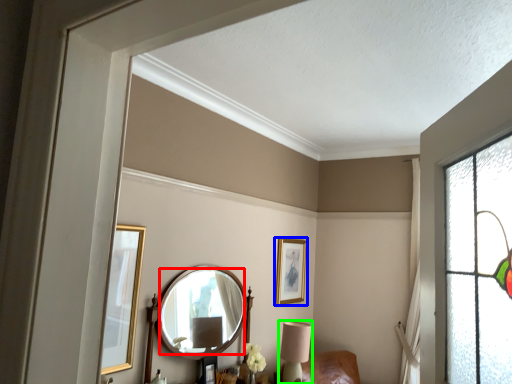
Question: Which object is positioned closest to mirror (highlighted by a red box)? Select from picture frame (highlighted by a blue box) and table lamp (highlighted by a green box).

Choices:
 (A) picture frame
 (B) table lamp

Answer: (B)